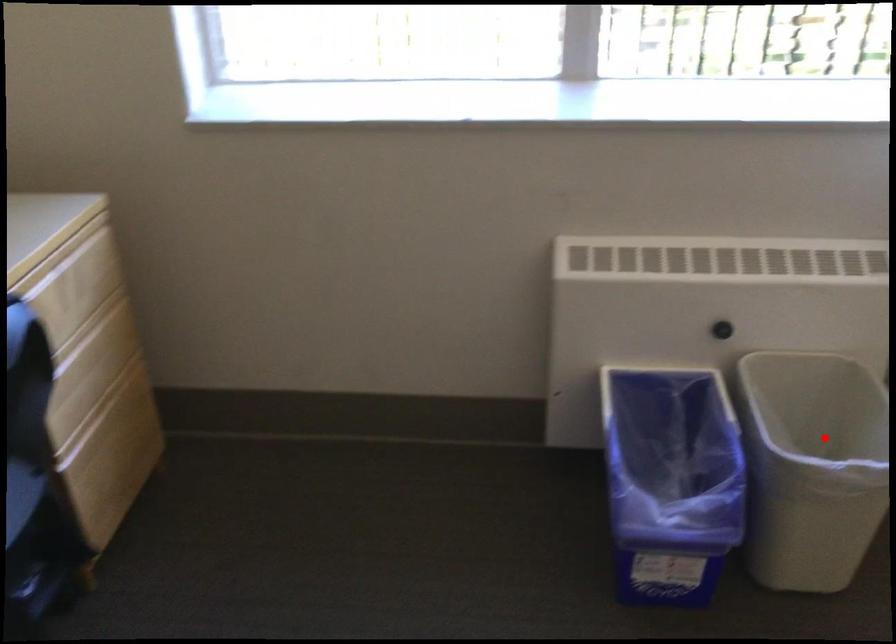
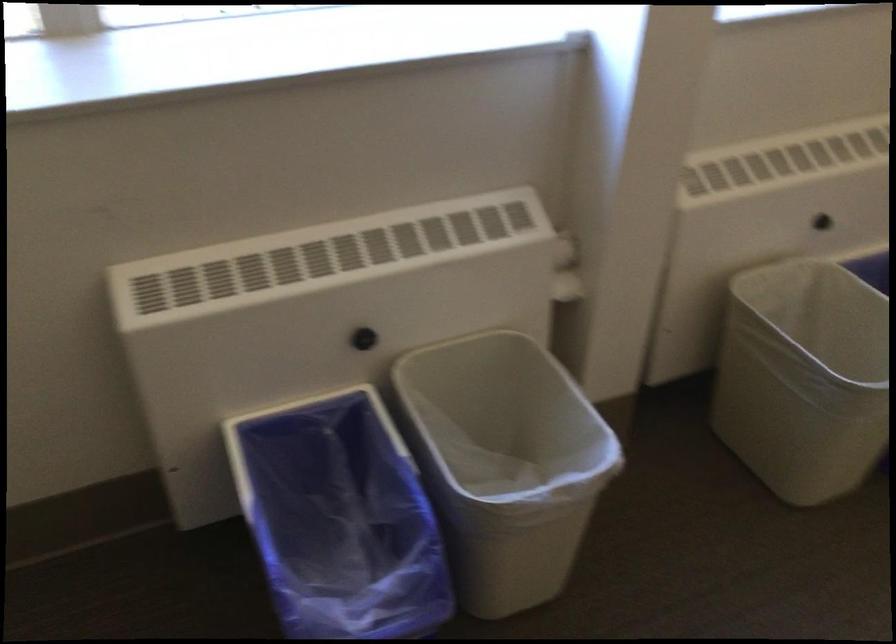
Question: I am providing you with two images of the same scene from different viewpoints. A red point is marked on the first image. At the location where the point appears in image 1, is it still visible in image 2?

Choices:
 (A) Yes
 (B) No

Answer: (A)